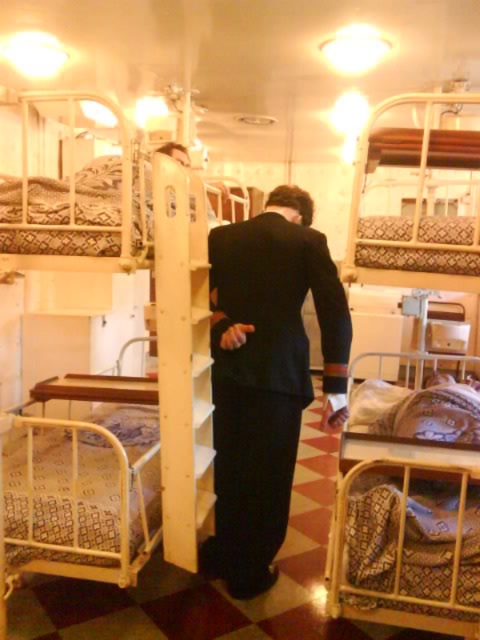
You are standing in the ship cabin and want to take a photo of the black smooth suit at center. If your camera has a minimum focus distance of 7 feet, will you need to move closer to take a clear photo?

The black smooth suit at center is 6.97 feet away from the camera, which is just under the minimum focus distance of 7 feet. Therefore, you do not need to move closer to take a clear photo.